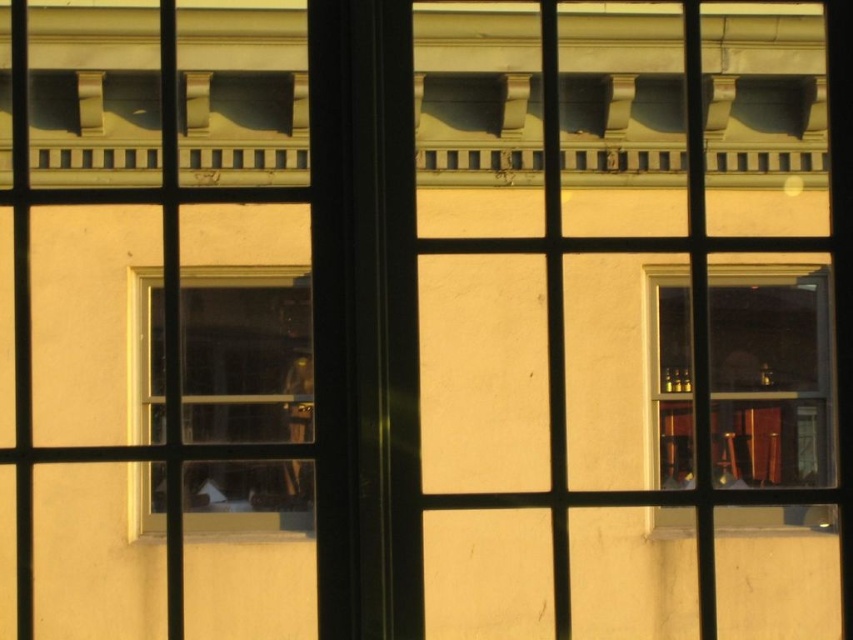
Question: Which point is farther from the camera taking this photo?

Choices:
 (A) (299, 515)
 (B) (741, 403)

Answer: (B)

Question: Does transparent glass window at center lie in front of transparent glass window at upper right?

Choices:
 (A) no
 (B) yes

Answer: (B)

Question: Among these points, which one is nearest to the camera?

Choices:
 (A) (795, 416)
 (B) (247, 392)

Answer: (B)

Question: Which point is farther from the camera taking this photo?

Choices:
 (A) (140, 349)
 (B) (711, 435)

Answer: (B)

Question: Is transparent glass window at center thinner than transparent glass window at upper right?

Choices:
 (A) yes
 (B) no

Answer: (A)

Question: Is transparent glass window at center closer to camera compared to transparent glass window at upper right?

Choices:
 (A) yes
 (B) no

Answer: (A)